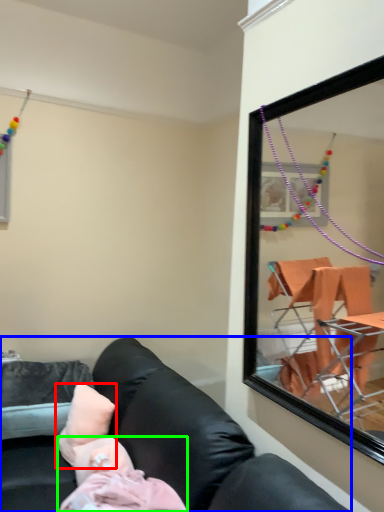
Question: Based on their relative distances, which object is farther from pillow (highlighted by a red box)? Choose from studio couch (highlighted by a blue box) and person (highlighted by a green box).

Choices:
 (A) studio couch
 (B) person

Answer: (A)